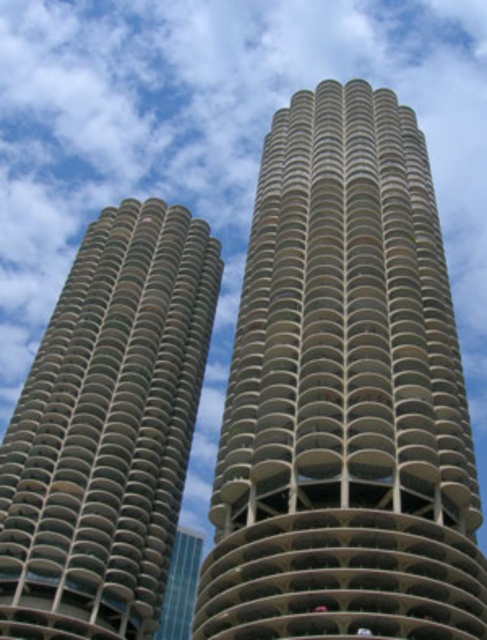
Question: Is beige concrete tower at center closer to camera compared to concrete textured building at left?

Choices:
 (A) yes
 (B) no

Answer: (A)

Question: Among these points, which one is nearest to the camera?

Choices:
 (A) (113, 636)
 (B) (370, 499)

Answer: (B)

Question: Which object appears farthest from the camera in this image?

Choices:
 (A) concrete textured building at left
 (B) beige concrete tower at center

Answer: (A)

Question: Is beige concrete tower at center wider than concrete textured building at left?

Choices:
 (A) yes
 (B) no

Answer: (A)

Question: Does beige concrete tower at center appear on the right side of concrete textured building at left?

Choices:
 (A) yes
 (B) no

Answer: (A)